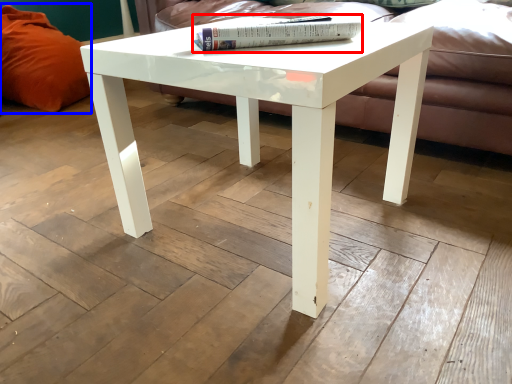
Question: Which of the following is the closest to the observer, book (highlighted by a red box) or pillow (highlighted by a blue box)?

Choices:
 (A) book
 (B) pillow

Answer: (A)